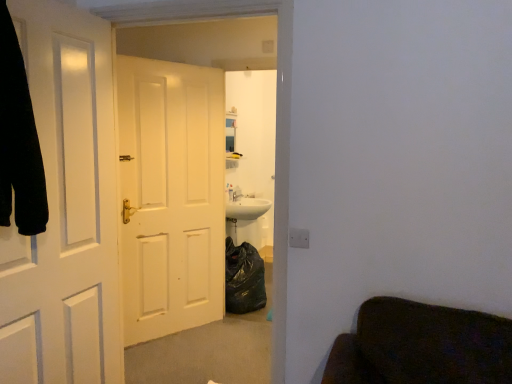
Question: Is black fabric robe at left closer to the viewer compared to white matte door at left, the 1th door positioned from the front?

Choices:
 (A) no
 (B) yes

Answer: (B)

Question: Is black fabric robe at left oriented towards white matte door at left, the 1th door positioned from the front?

Choices:
 (A) no
 (B) yes

Answer: (A)

Question: From a real-world perspective, is black fabric robe at left physically above white matte door at left, arranged as the 2th door when viewed from the back?

Choices:
 (A) yes
 (B) no

Answer: (A)

Question: Considering the relative positions of black fabric robe at left and white matte door at left, the 1th door positioned from the front, in the image provided, is black fabric robe at left to the right of white matte door at left, the 1th door positioned from the front, from the viewer's perspective?

Choices:
 (A) no
 (B) yes

Answer: (A)

Question: Considering the relative sizes of black fabric robe at left and white matte door at left, arranged as the 2th door when viewed from the back, in the image provided, is black fabric robe at left shorter than white matte door at left, arranged as the 2th door when viewed from the back,?

Choices:
 (A) yes
 (B) no

Answer: (A)

Question: Is point (139, 299) closer or farther from the camera than point (70, 256)?

Choices:
 (A) closer
 (B) farther

Answer: (B)

Question: In the image, is white matte door at center, positioned as the 1th door in back-to-front order, positioned in front of or behind white matte door at left, arranged as the 2th door when viewed from the back?

Choices:
 (A) behind
 (B) front

Answer: (A)

Question: From their relative heights in the image, would you say white matte door at center, which is the 2th door in front-to-back order, is taller or shorter than white matte door at left, arranged as the 2th door when viewed from the back?

Choices:
 (A) tall
 (B) short

Answer: (A)

Question: In the image, is white matte door at center, which is the 2th door in front-to-back order, on the left side or the right side of white matte door at left, arranged as the 2th door when viewed from the back?

Choices:
 (A) left
 (B) right

Answer: (B)

Question: Is black fabric robe at left spatially inside white matte door at center, which is the 2th door in front-to-back order, or outside of it?

Choices:
 (A) inside
 (B) outside

Answer: (B)

Question: From a real-world perspective, is black fabric robe at left physically located above or below white matte door at center, positioned as the 1th door in back-to-front order?

Choices:
 (A) below
 (B) above

Answer: (B)

Question: Based on their sizes in the image, would you say black fabric robe at left is bigger or smaller than white matte door at center, positioned as the 1th door in back-to-front order?

Choices:
 (A) small
 (B) big

Answer: (A)

Question: Is point (26, 210) closer or farther from the camera than point (200, 289)?

Choices:
 (A) closer
 (B) farther

Answer: (A)

Question: Is white matte door at left, the 1th door positioned from the front, wider or thinner than black fabric robe at left?

Choices:
 (A) wide
 (B) thin

Answer: (B)

Question: Which is correct: white matte door at left, the 1th door positioned from the front, is inside black fabric robe at left, or outside of it?

Choices:
 (A) inside
 (B) outside

Answer: (B)